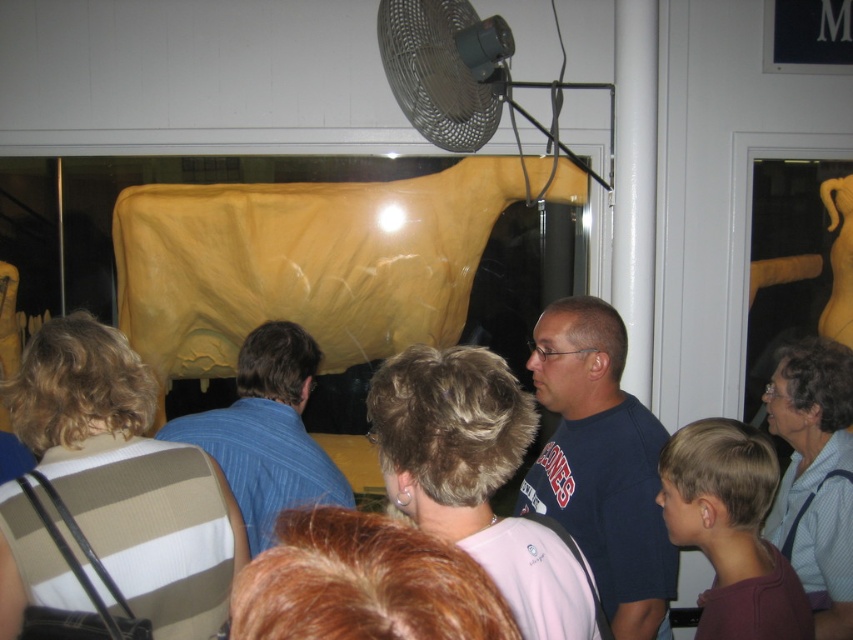
Can you confirm if blue striped shirt at center is shorter than black mesh fan at upper center?

In fact, blue striped shirt at center may be taller than black mesh fan at upper center.

In the scene shown: Is the position of blue striped shirt at center less distant than that of black mesh fan at upper center?

No, it is not.

Is point (241, 513) farther from viewer compared to point (492, 104)?

No, it is in front of (492, 104).

Locate an element on the screen. The width and height of the screenshot is (853, 640). blue striped shirt at center is located at coordinates (267, 433).

Is brown striped shirt at center to the left of dark blue t-shirt at center from the viewer's perspective?

Correct, you'll find brown striped shirt at center to the left of dark blue t-shirt at center.

Who is more forward, (178, 476) or (660, 620)?

Point (178, 476) is in front.

This screenshot has height=640, width=853. Identify the location of brown striped shirt at center. (109, 493).

Is brown striped shirt at center shorter than black mesh fan at upper center?

Incorrect, brown striped shirt at center's height does not fall short of black mesh fan at upper center's.

Is the position of brown striped shirt at center less distant than that of black mesh fan at upper center?

Yes, it is in front of black mesh fan at upper center.

At what (x,y) coordinates should I click in order to perform the action: click on brown striped shirt at center. Please return your answer as a coordinate pair (x, y). Looking at the image, I should click on (109, 493).